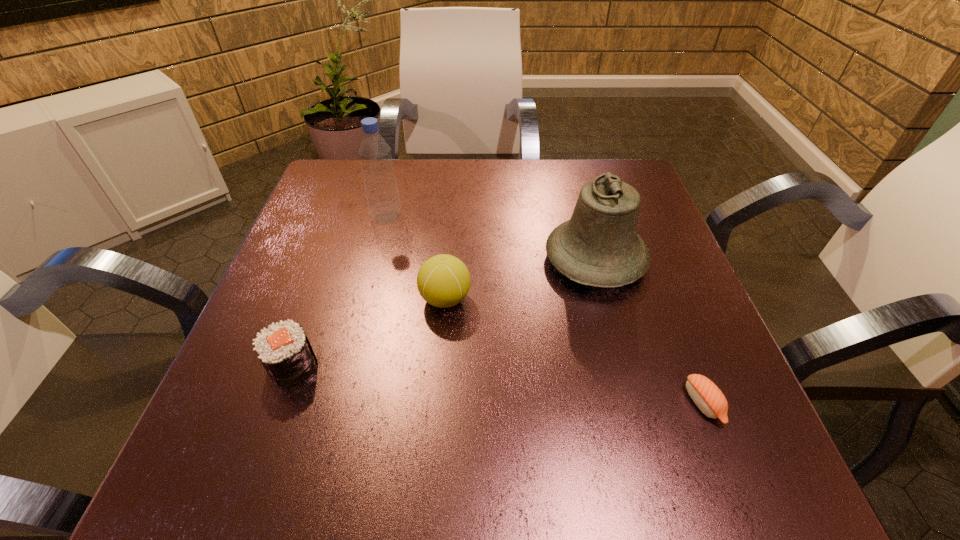
Find the location of a particular element. This screenshot has height=540, width=960. vacant point that satisfies the following two spatial constraints: 1. on the back side of the third object from right to left; 2. on the left side of the bell is located at coordinates (448, 260).

Image resolution: width=960 pixels, height=540 pixels. What are the coordinates of `free region that satisfies the following two spatial constraints: 1. on the front side of the shortest object; 2. on the left side of the bell` in the screenshot? It's located at (635, 403).

Locate an element on the screen. Image resolution: width=960 pixels, height=540 pixels. free space that satisfies the following two spatial constraints: 1. on the front side of the right sushi; 2. on the left side of the left sushi is located at coordinates (278, 403).